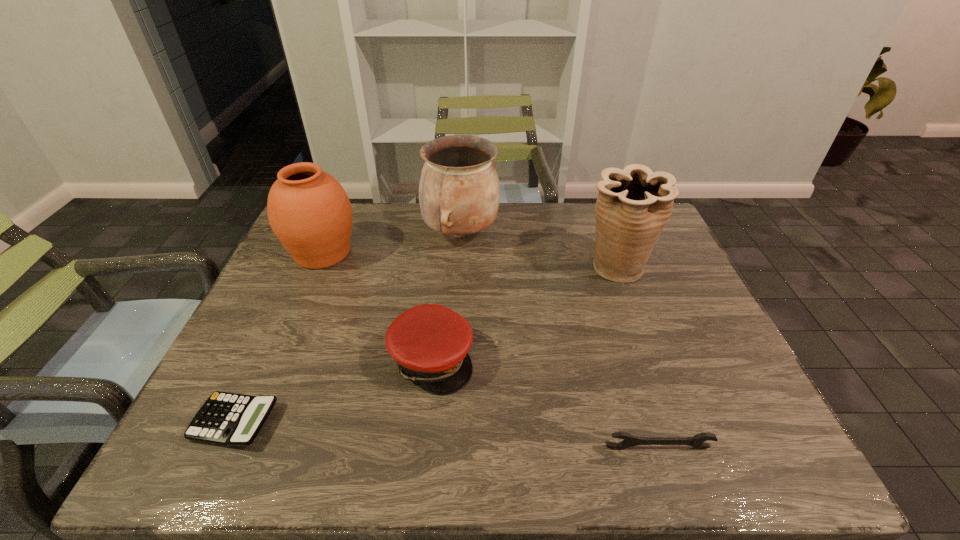
At what (x,y) coordinates should I click in order to perform the action: click on the second urn from right to left. Please return your answer as a coordinate pair (x, y). Looking at the image, I should click on (459, 193).

The width and height of the screenshot is (960, 540). Find the location of `the rightmost urn`. the rightmost urn is located at coordinates (634, 204).

Find the location of a particular element. This screenshot has height=540, width=960. the leftmost urn is located at coordinates (310, 213).

This screenshot has width=960, height=540. What are the coordinates of `the third shortest object` in the screenshot? It's located at (430, 342).

Locate an element on the screen. the second shortest object is located at coordinates pyautogui.click(x=697, y=441).

Identify the location of the shortest object. The image size is (960, 540). (230, 419).

This screenshot has height=540, width=960. I want to click on free location located 0.130m on the left of the second urn from right to left, so click(x=382, y=233).

This screenshot has height=540, width=960. What are the coordinates of `vacant area located on the front of the rightmost urn` in the screenshot? It's located at (650, 362).

Locate an element on the screen. This screenshot has width=960, height=540. blank area located on the front of the leftmost urn is located at coordinates (282, 345).

The width and height of the screenshot is (960, 540). What are the coordinates of `free region located 0.320m at the front of the fourth tallest object where the visor is located` in the screenshot? It's located at [x=611, y=359].